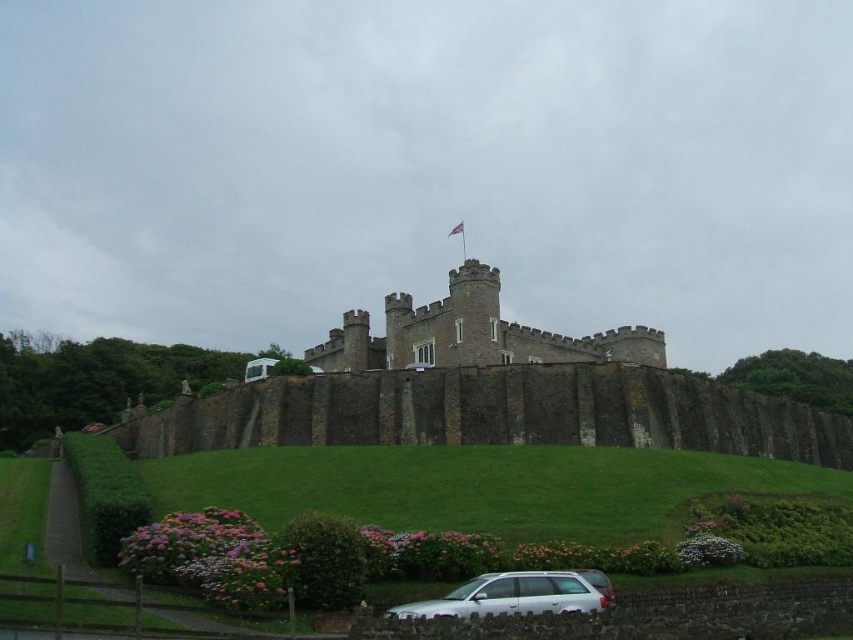
Is point (492, 364) less distant than point (578, 596)?

That is False.

Which is in front, point (618, 348) or point (415, 614)?

Point (415, 614)

Does point (508, 344) come closer to viewer compared to point (561, 593)?

No.

Find the location of `smooth stone castle at center`. smooth stone castle at center is located at coordinates (469, 333).